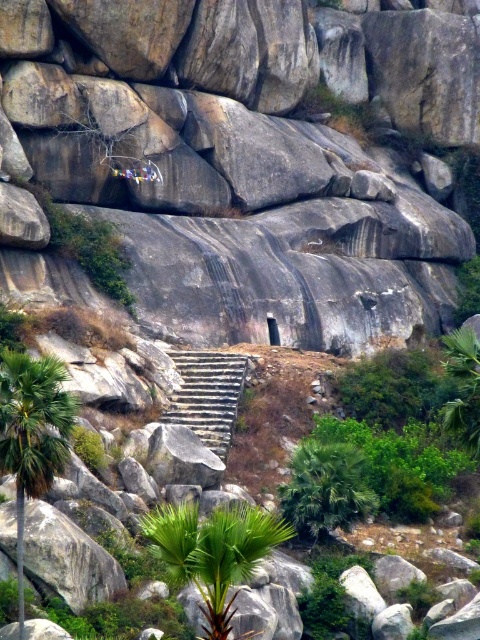
Does green leafy palm at lower center have a smaller size compared to green leafy palm at center?

No.

Is green leafy palm at lower center behind green leafy palm at center?

No.

Measure the distance between green leafy palm at lower center and camera.

green leafy palm at lower center and camera are 57.60 meters apart.

Where is `green leafy palm at lower center`? green leafy palm at lower center is located at coordinates (214, 552).

Can you confirm if green leafy palm at center is bigger than gray stone stairs at center?

Actually, green leafy palm at center might be smaller than gray stone stairs at center.

Based on the photo, who is higher up, green leafy palm at center or gray stone stairs at center?

gray stone stairs at center

Between point (316, 442) and point (196, 356), which one is positioned behind?

Point (196, 356)

Find the location of a particular element. The height and width of the screenshot is (640, 480). green leafy palm at center is located at coordinates (325, 486).

Does green leafy palm at lower center appear over gray stone stairs at center?

No, green leafy palm at lower center is not above gray stone stairs at center.

What do you see at coordinates (214, 552) in the screenshot? The image size is (480, 640). I see `green leafy palm at lower center` at bounding box center [214, 552].

You are a GUI agent. You are given a task and a screenshot of the screen. Output one action in this format:
    pyautogui.click(x=<x>, y=<y>)
    Task: Click on the green leafy palm at lower center
    
    Given the screenshot: What is the action you would take?
    pyautogui.click(x=214, y=552)